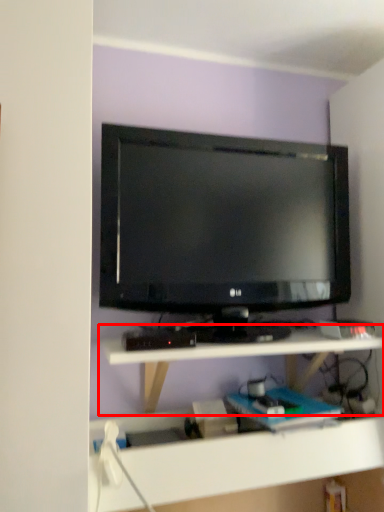
Question: From the image's perspective, considering the relative positions of shelf (annotated by the red box) and television in the image provided, where is shelf (annotated by the red box) located with respect to the staircase?

Choices:
 (A) above
 (B) below

Answer: (B)